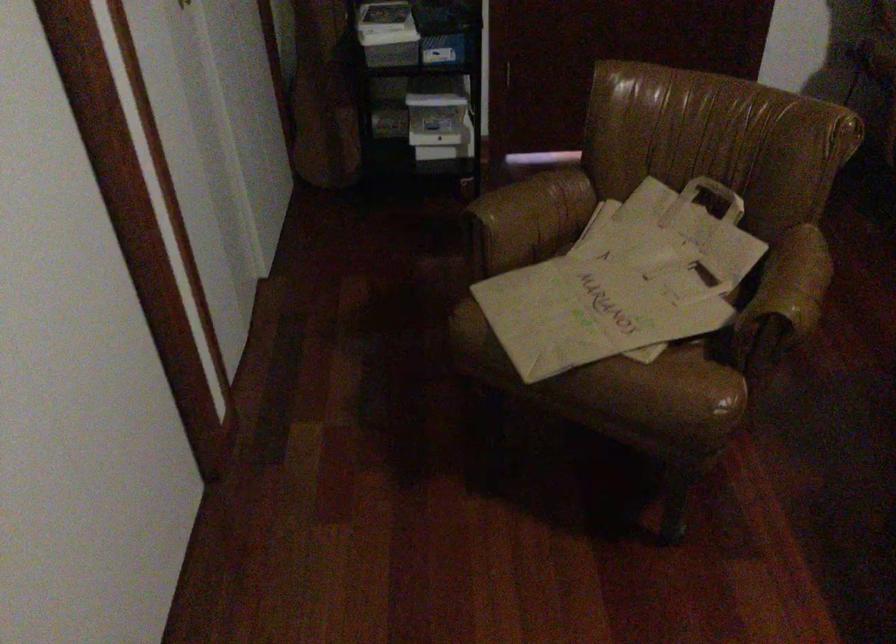
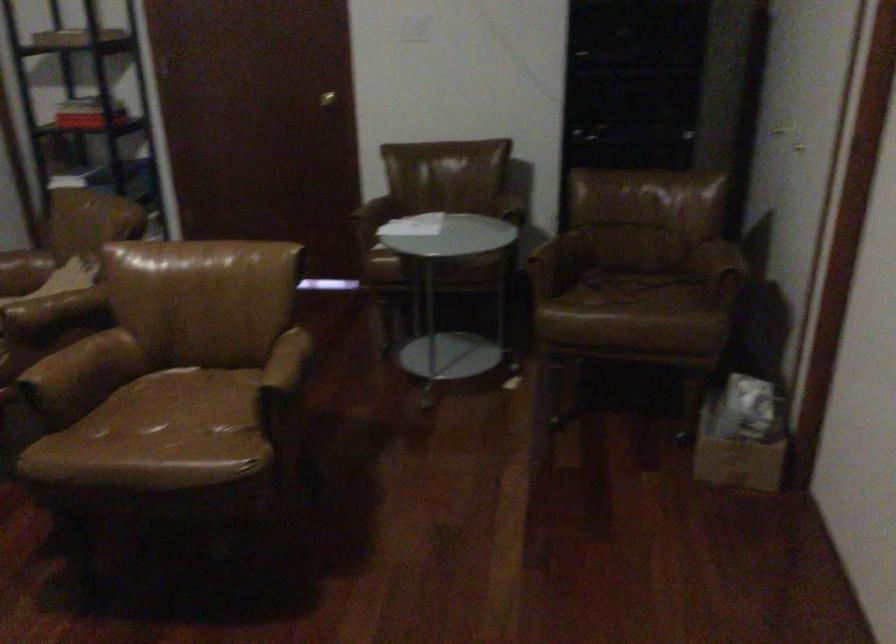
Question: The images are taken continuously from a first-person perspective. In which direction are you moving?

Choices:
 (A) Left
 (B) Right
 (C) Forward
 (D) Backward

Answer: (B)